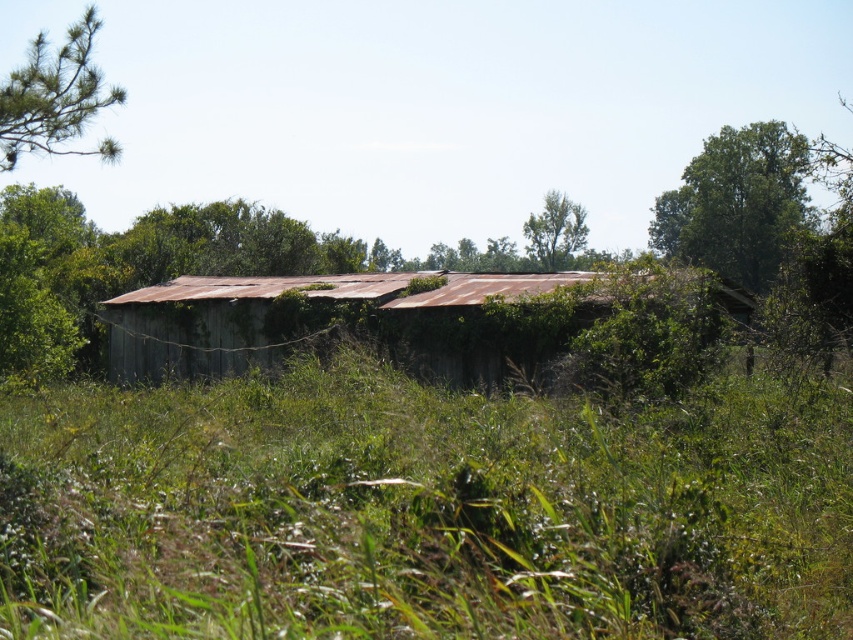
Question: Is the position of rusty metal barn at center less distant than that of green matte tree at upper left?

Choices:
 (A) yes
 (B) no

Answer: (A)

Question: Which object is positioned farthest from the rusty metal barn at center?

Choices:
 (A) green matte tree at upper left
 (B) green leafy tree at upper center
 (C) green leafy tree at upper right

Answer: (B)

Question: Which point appears closest to the camera in this image?

Choices:
 (A) (527, 237)
 (B) (671, 250)
 (C) (44, 97)

Answer: (C)

Question: Does rusty metal barn at center have a greater width compared to green leafy tree at upper right?

Choices:
 (A) yes
 (B) no

Answer: (B)

Question: Which object is positioned closest to the rusty metal barn at center?

Choices:
 (A) green leafy tree at upper center
 (B) green leafy tree at upper right
 (C) green matte tree at upper left

Answer: (C)

Question: Is the position of rusty metal barn at center more distant than that of green matte tree at upper left?

Choices:
 (A) no
 (B) yes

Answer: (A)